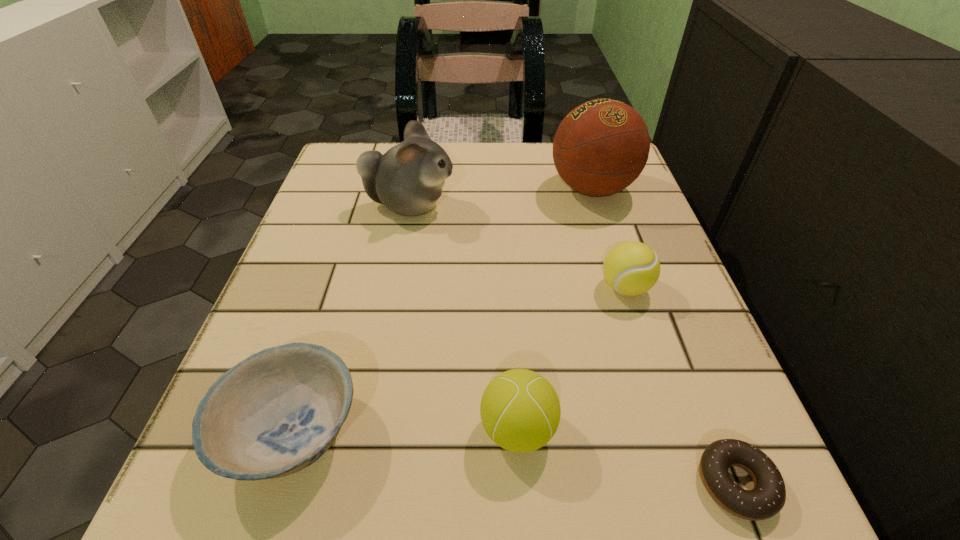
Identify the location of free spot located 0.200m on the left of the left tennis ball. (324, 429).

Locate an element on the screen. Image resolution: width=960 pixels, height=540 pixels. vacant space positioned on the front of the third farthest object is located at coordinates (681, 462).

Where is `vacant space located on the back of the fifth tallest object`? vacant space located on the back of the fifth tallest object is located at coordinates (362, 211).

Locate an element on the screen. This screenshot has width=960, height=540. free space located on the back of the shortest object is located at coordinates (655, 276).

At what (x,y) coordinates should I click in order to perform the action: click on basketball located at the far edge. Please return your answer as a coordinate pair (x, y). Looking at the image, I should click on (601, 147).

Find the location of `hamster located at the far edge`. hamster located at the far edge is located at coordinates point(408,179).

Where is `tennis ball present at the near edge`? tennis ball present at the near edge is located at coordinates (520, 411).

At what (x,y) coordinates should I click in order to perform the action: click on bowl located in the near edge section of the desktop. Please return your answer as a coordinate pair (x, y). Looking at the image, I should click on (275, 413).

In order to click on doughnut present at the near edge in this screenshot , I will do `click(767, 498)`.

What are the coordinates of `hamster located at the left edge` in the screenshot? It's located at (408, 179).